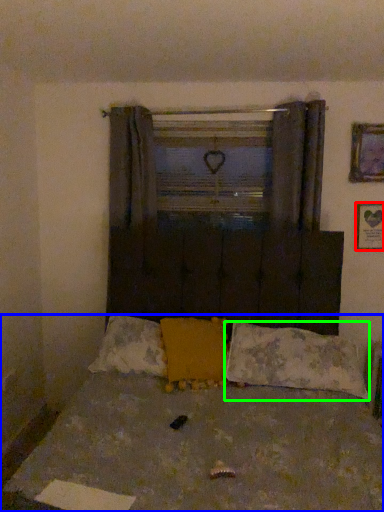
Question: Estimate the real-world distances between objects in this image. Which object is farther from picture frame (highlighted by a red box), bed (highlighted by a blue box) or pillow (highlighted by a green box)?

Choices:
 (A) bed
 (B) pillow

Answer: (A)